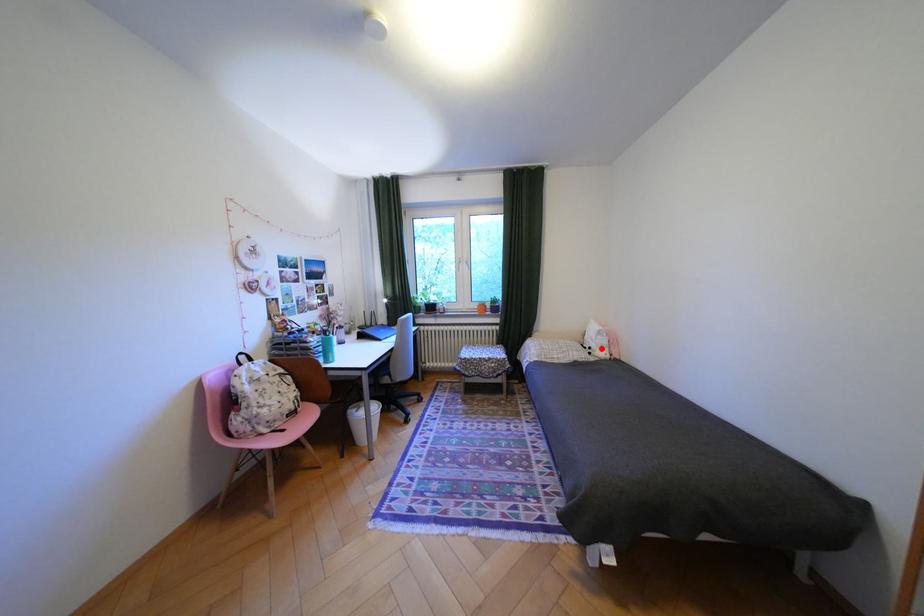
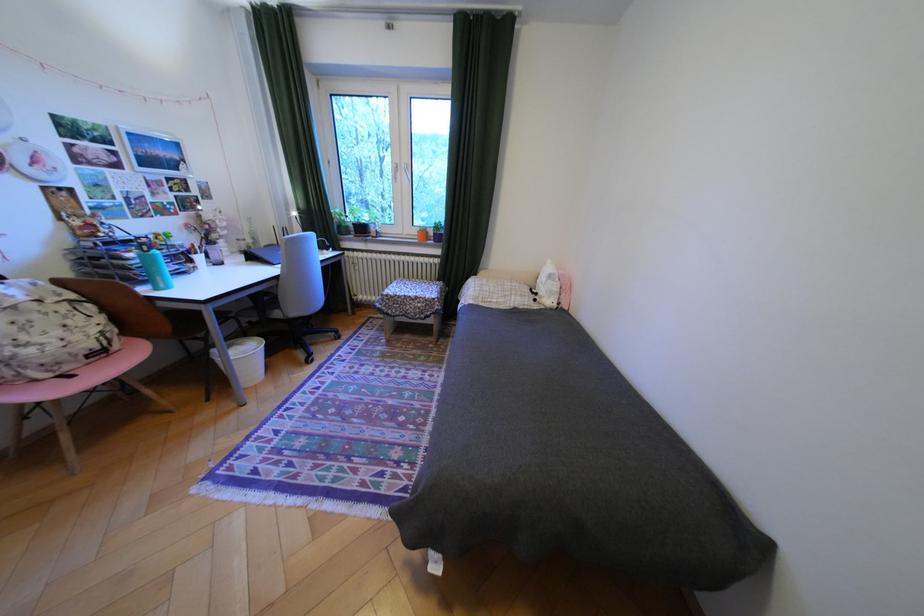
Locate, in the second image, the point that corresponds to the highlighted location in the first image.

(548, 294)